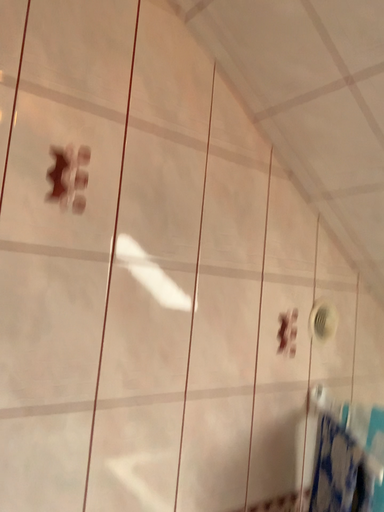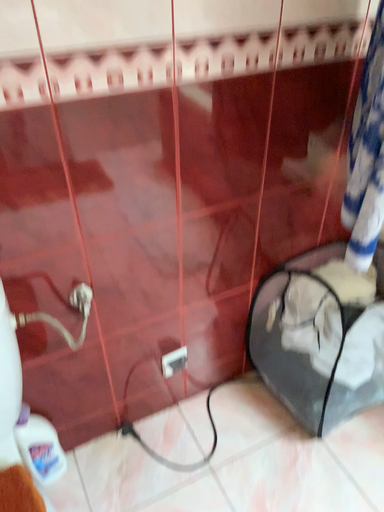
Question: How did the camera likely rotate when shooting the video?

Choices:
 (A) rotated left
 (B) rotated right

Answer: (A)